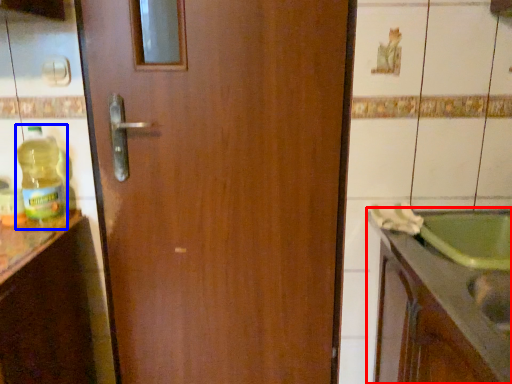
Question: Which object is further to the camera taking this photo, countertop (highlighted by a red box) or bottle (highlighted by a blue box)?

Choices:
 (A) countertop
 (B) bottle

Answer: (B)